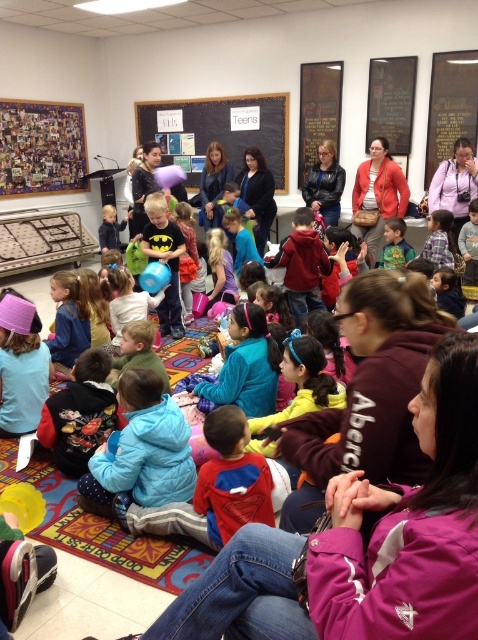
How distant is blue fleece jacket at lower left from matte black batman shirt at center?

The distance of blue fleece jacket at lower left from matte black batman shirt at center is 7.78 feet.

Can you confirm if blue fleece jacket at lower left is smaller than matte black batman shirt at center?

Correct, blue fleece jacket at lower left occupies less space than matte black batman shirt at center.

Is point (98, 452) farther from camera compared to point (148, 250)?

No, (98, 452) is in front of (148, 250).

Where is `blue fleece jacket at lower left`? The width and height of the screenshot is (478, 640). blue fleece jacket at lower left is located at coordinates (141, 451).

Between blue fleece jacket at lower left and blue fleece jacket at lower center, which one has more height?

blue fleece jacket at lower left is taller.

Who is positioned more to the left, blue fleece jacket at lower left or blue fleece jacket at lower center?

From the viewer's perspective, blue fleece jacket at lower left appears more on the left side.

Which is in front, point (174, 417) or point (217, 502)?

Point (217, 502) is in front.

Where is `blue fleece jacket at lower left`? Image resolution: width=478 pixels, height=640 pixels. blue fleece jacket at lower left is located at coordinates click(x=141, y=451).

Can you confirm if blue fleece jacket at lower left is positioned to the left of matte red jacket at upper right?

Yes, blue fleece jacket at lower left is to the left of matte red jacket at upper right.

Where is `blue fleece jacket at lower left`? The height and width of the screenshot is (640, 478). blue fleece jacket at lower left is located at coordinates (141, 451).